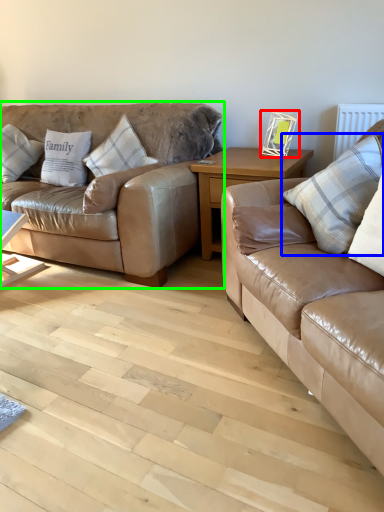
Question: Which is nearer to the picture frame (highlighted by a red box)? pillow (highlighted by a blue box) or studio couch (highlighted by a green box).

Choices:
 (A) pillow
 (B) studio couch

Answer: (A)